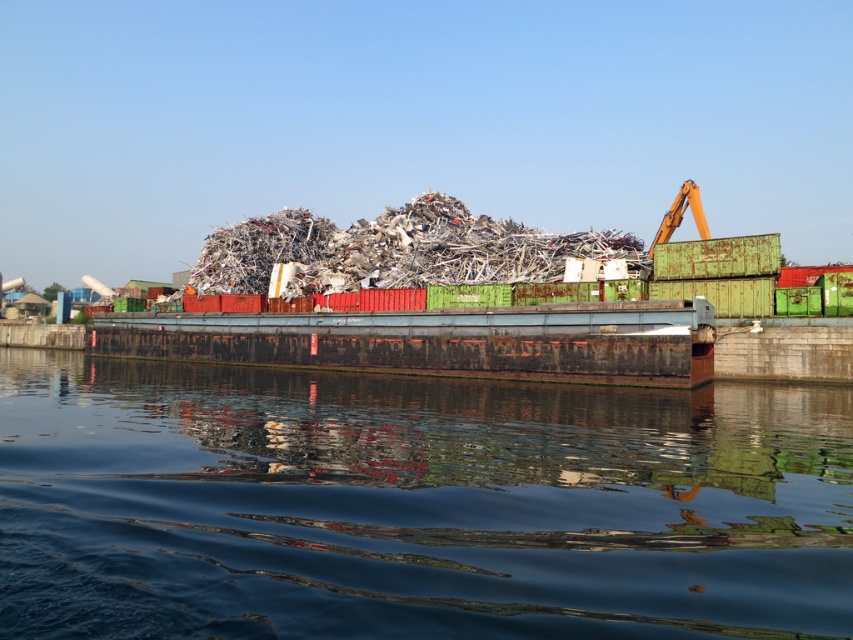
Question: Which object is farther from the camera taking this photo?

Choices:
 (A) shiny metallic debris at center
 (B) transparent water at center
 (C) rusty metal barge at center

Answer: (A)

Question: Does transparent water at center appear over rusty metal barge at center?

Choices:
 (A) no
 (B) yes

Answer: (A)

Question: Does transparent water at center appear over shiny metallic debris at center?

Choices:
 (A) no
 (B) yes

Answer: (A)

Question: Is transparent water at center closer to the viewer compared to rusty metal barge at center?

Choices:
 (A) yes
 (B) no

Answer: (A)

Question: Based on their relative distances, which object is farther from the rusty metal barge at center?

Choices:
 (A) transparent water at center
 (B) shiny metallic debris at center

Answer: (A)

Question: Which object appears closest to the camera in this image?

Choices:
 (A) transparent water at center
 (B) rusty metal barge at center
 (C) shiny metallic debris at center

Answer: (A)